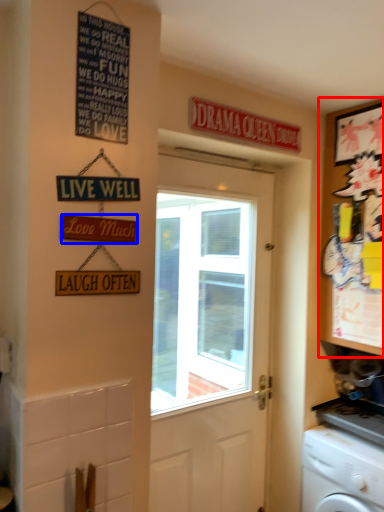
Question: Which object appears farthest to the camera in this image, cabinetry (highlighted by a red box) or parking sign (highlighted by a blue box)?

Choices:
 (A) cabinetry
 (B) parking sign

Answer: (A)